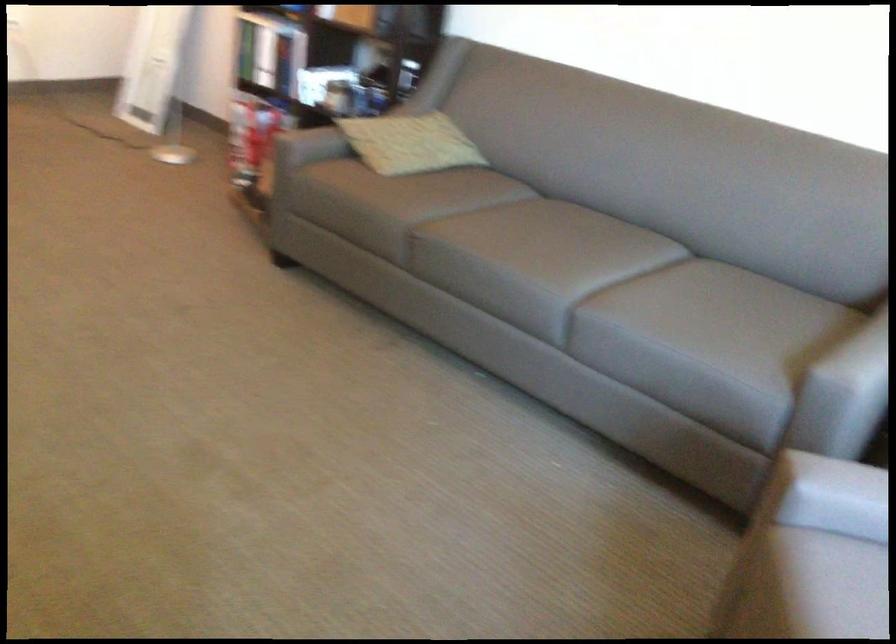
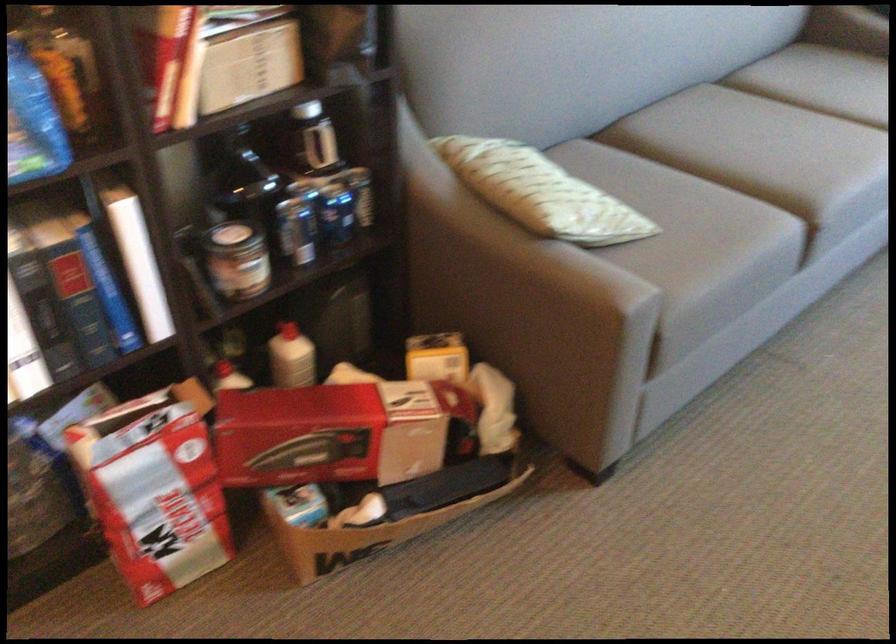
Locate, in the second image, the point that corresponds to the point at 343,98 in the first image.

(338, 218)